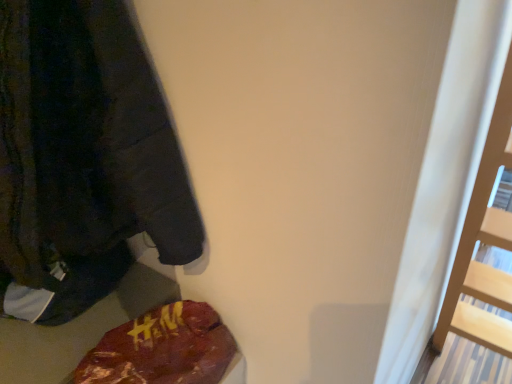
Question: Considering the relative positions of dark gray fleece sweatshirt at left and maroon fabric bag at lower left in the image provided, is dark gray fleece sweatshirt at left in front of maroon fabric bag at lower left?

Choices:
 (A) no
 (B) yes

Answer: (B)

Question: From the image's perspective, is dark gray fleece sweatshirt at left on maroon fabric bag at lower left?

Choices:
 (A) yes
 (B) no

Answer: (A)

Question: Is dark gray fleece sweatshirt at left turned away from maroon fabric bag at lower left?

Choices:
 (A) yes
 (B) no

Answer: (B)

Question: Is dark gray fleece sweatshirt at left smaller than maroon fabric bag at lower left?

Choices:
 (A) yes
 (B) no

Answer: (B)

Question: Could you tell me if dark gray fleece sweatshirt at left is turned towards maroon fabric bag at lower left?

Choices:
 (A) yes
 (B) no

Answer: (B)

Question: From the image's perspective, is dark gray fleece sweatshirt at left beneath maroon fabric bag at lower left?

Choices:
 (A) yes
 (B) no

Answer: (B)

Question: Is dark gray fleece sweatshirt at left a part of maroon fabric bag at lower left?

Choices:
 (A) yes
 (B) no

Answer: (B)

Question: Is maroon fabric bag at lower left positioned in front of dark gray fleece sweatshirt at left?

Choices:
 (A) yes
 (B) no

Answer: (B)

Question: Can you confirm if maroon fabric bag at lower left is positioned to the right of dark gray fleece sweatshirt at left?

Choices:
 (A) yes
 (B) no

Answer: (A)

Question: Is maroon fabric bag at lower left next to dark gray fleece sweatshirt at left and touching it?

Choices:
 (A) yes
 (B) no

Answer: (B)

Question: Considering the relative sizes of maroon fabric bag at lower left and dark gray fleece sweatshirt at left in the image provided, is maroon fabric bag at lower left bigger than dark gray fleece sweatshirt at left?

Choices:
 (A) yes
 (B) no

Answer: (B)

Question: Considering the relative positions of maroon fabric bag at lower left and dark gray fleece sweatshirt at left in the image provided, is maroon fabric bag at lower left behind dark gray fleece sweatshirt at left?

Choices:
 (A) no
 (B) yes

Answer: (B)

Question: Considering the positions of point (115, 228) and point (106, 334), is point (115, 228) closer or farther from the camera than point (106, 334)?

Choices:
 (A) farther
 (B) closer

Answer: (B)